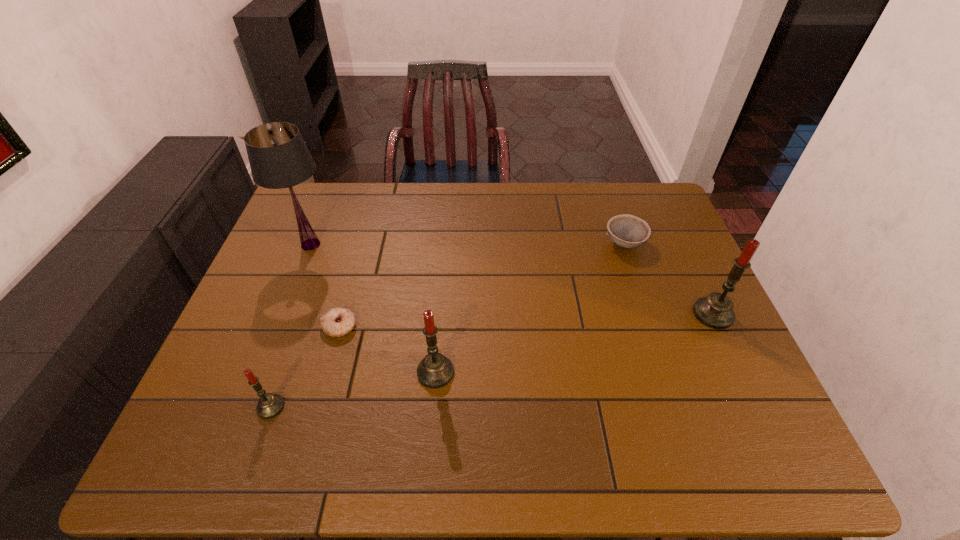
You are a GUI agent. You are given a task and a screenshot of the screen. Output one action in this format:
    pyautogui.click(x=<x>, y=<y>)
    Task: Click on the bowl that is at the right edge
    
    Given the screenshot: What is the action you would take?
    pyautogui.click(x=627, y=231)

I want to click on object that is positioned at the near left corner, so click(269, 405).

Where is `vacant space at the far edge`? Image resolution: width=960 pixels, height=540 pixels. vacant space at the far edge is located at coordinates (495, 195).

Find the location of `vacant space at the near edge`. vacant space at the near edge is located at coordinates (562, 397).

This screenshot has width=960, height=540. Find the location of `vacant space at the left edge`. vacant space at the left edge is located at coordinates (327, 235).

Locate an element on the screen. free space at the right edge of the desktop is located at coordinates (679, 245).

In the image, there is a desktop. At what (x,y) coordinates should I click in order to perform the action: click on free region at the far left corner. Please return your answer as a coordinate pair (x, y). The width and height of the screenshot is (960, 540). Looking at the image, I should click on (324, 211).

I want to click on free space at the far right corner, so click(x=661, y=214).

Find the location of a particular element. The image size is (960, 540). vacant point located between the nearest object and the bowl is located at coordinates (447, 325).

Find the location of a particular element. This screenshot has width=960, height=540. unoccupied area between the fifth tallest object and the shortest candle is located at coordinates (447, 325).